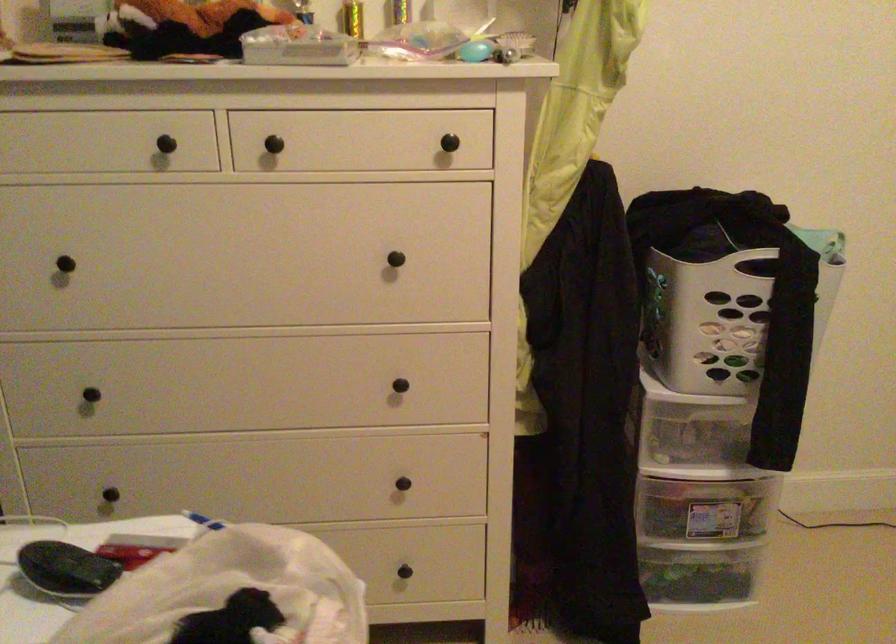
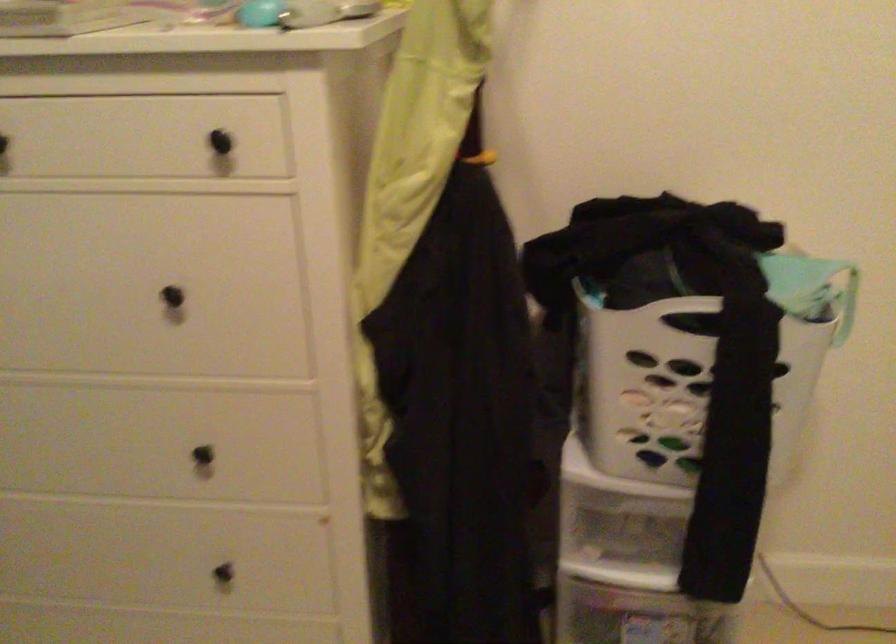
Find the pixel in the second image that matches point (400, 395) in the first image.

(213, 462)